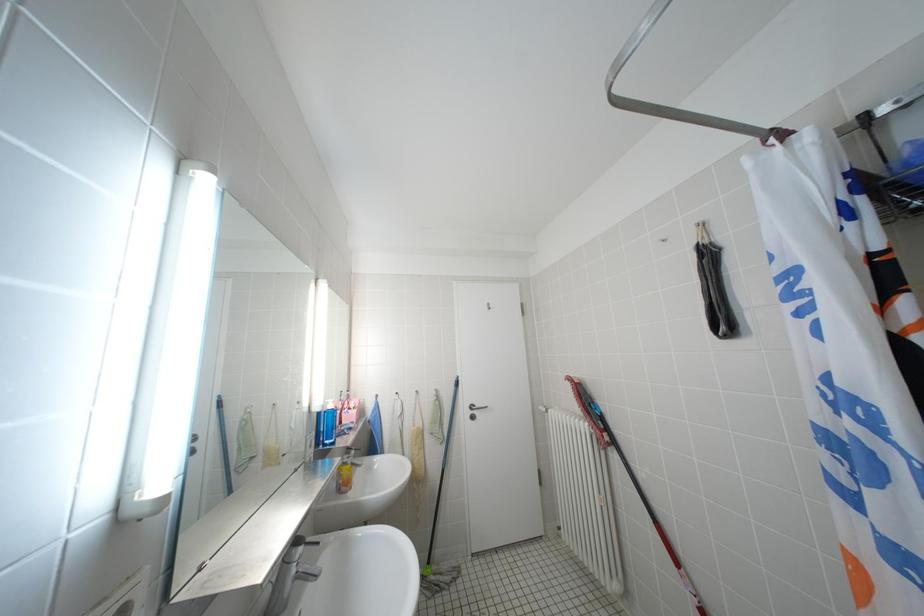
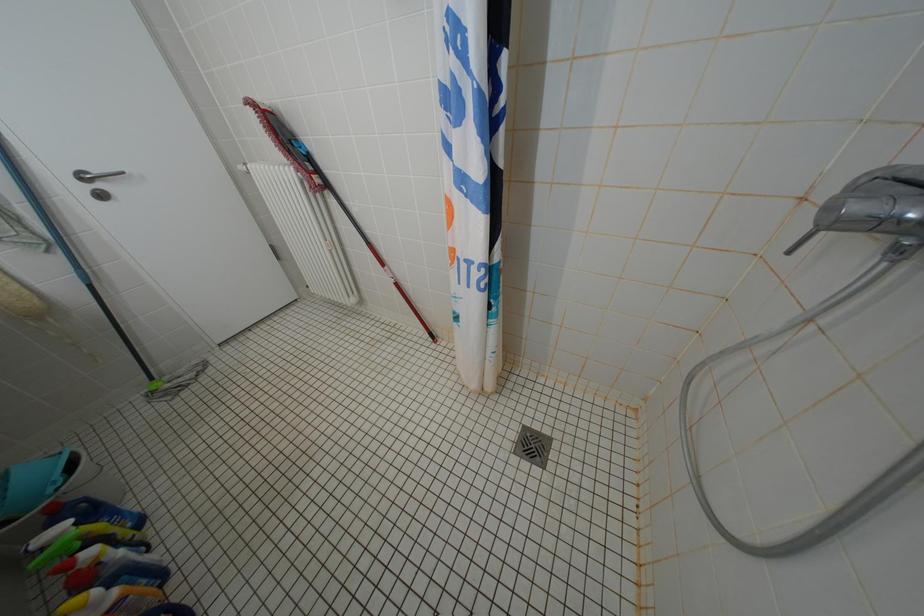
Based on the continuous images, in which direction is the camera rotating?

The camera rotated toward right-down.